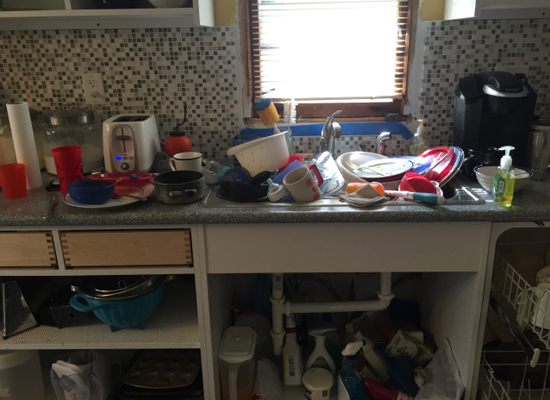
Image resolution: width=550 pixels, height=400 pixels. What are the coordinates of `cupboard` in the screenshot? It's located at (64, 11), (469, 10).